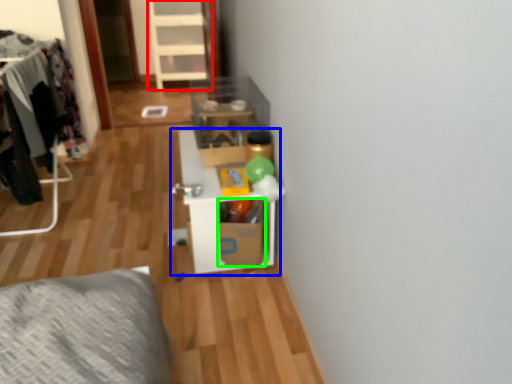
Question: Which object is the farthest from dresser (highlighted by a red box)? Choose among these: shelf (highlighted by a blue box) or cardboard box (highlighted by a green box).

Choices:
 (A) shelf
 (B) cardboard box

Answer: (B)